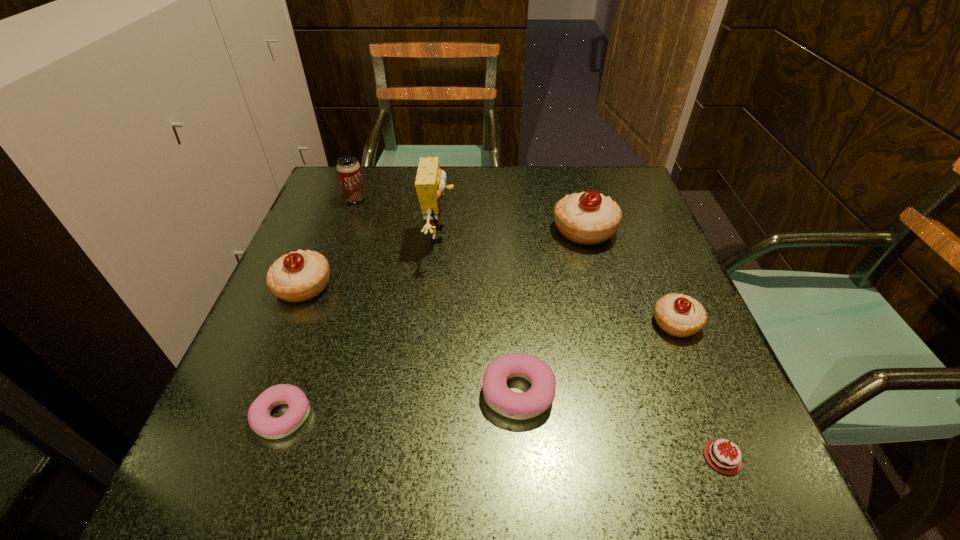
Where is `the bigger pink pastry`? the bigger pink pastry is located at coordinates (529, 404).

Locate an element on the screen. the smaller pink pastry is located at coordinates (260, 421).

Where is `the shortest pastry`? This screenshot has height=540, width=960. the shortest pastry is located at coordinates (260, 421).

This screenshot has height=540, width=960. In order to click on the shortest object in this screenshot , I will do `click(723, 461)`.

In order to click on red chocolate cake in this screenshot , I will do `click(723, 461)`.

In order to click on vacant area situated on the face of the sponge in this screenshot , I will do `click(612, 235)`.

Where is `vacant area situated on the back of the second beige pastry from left to right`? vacant area situated on the back of the second beige pastry from left to right is located at coordinates (570, 181).

The image size is (960, 540). I want to click on free spot located on the back of the red beer can, so click(x=362, y=180).

At what (x,y) coordinates should I click in order to perform the action: click on vacant space located 0.090m on the right of the second smallest beige pastry. Please return your answer as a coordinate pair (x, y). This screenshot has width=960, height=540. Looking at the image, I should click on (377, 286).

The image size is (960, 540). Find the location of `vacant region located on the back of the rightmost beige pastry`. vacant region located on the back of the rightmost beige pastry is located at coordinates (646, 252).